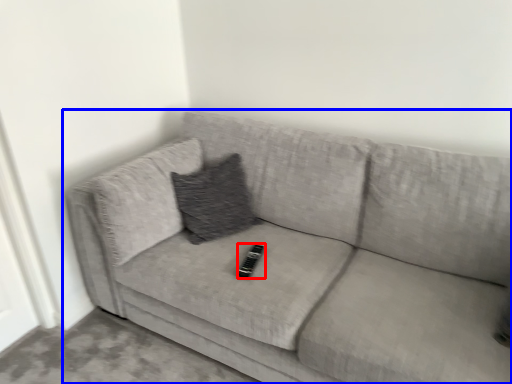
Question: Which of the following is the closest to the observer, remote (highlighted by a red box) or studio couch (highlighted by a blue box)?

Choices:
 (A) remote
 (B) studio couch

Answer: (B)